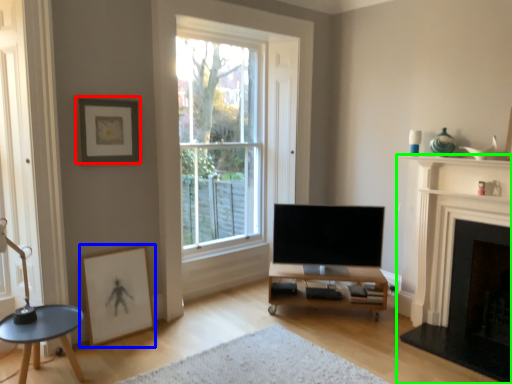
Question: Which object is the closest to the picture frame (highlighted by a red box)? Choose among these: picture frame (highlighted by a blue box) or fireplace (highlighted by a green box).

Choices:
 (A) picture frame
 (B) fireplace

Answer: (A)